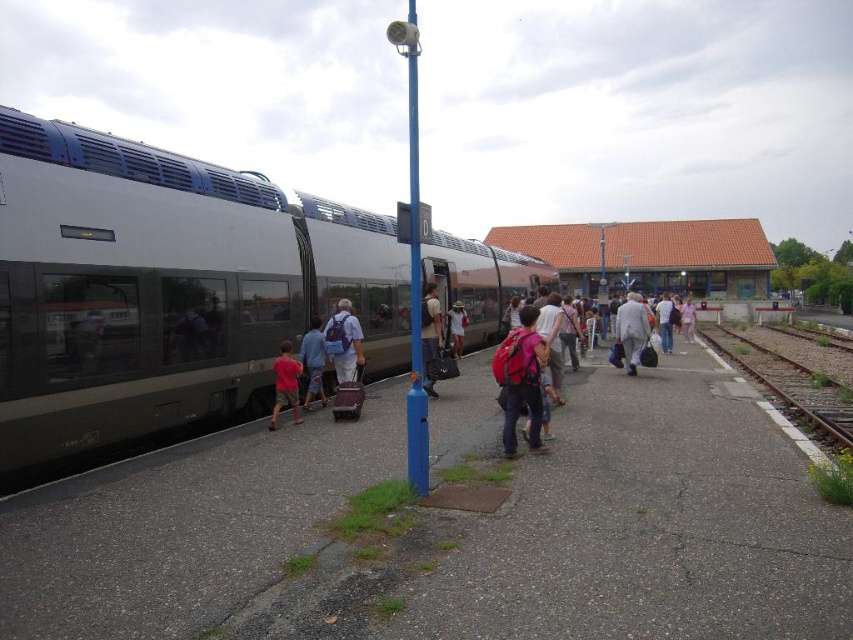
Which is more to the right, matte pink backpack at center or pink backpack at center?

Positioned to the right is matte pink backpack at center.

Can you confirm if matte pink backpack at center is bigger than pink backpack at center?

No, matte pink backpack at center is not bigger than pink backpack at center.

Describe the element at coordinates (521, 380) in the screenshot. I see `matte pink backpack at center` at that location.

Identify the location of matte pink backpack at center. (521, 380).

Who is more forward, (431,326) or (660,305)?

Point (431,326) is in front.

Find the location of a particular element. Image resolution: width=853 pixels, height=640 pixels. denim jacket at center is located at coordinates (430, 337).

Does denim jacket at center have a smaller size compared to pink backpack at center?

No.

Between denim jacket at center and pink backpack at center, which one is positioned higher?

denim jacket at center is above.

This screenshot has height=640, width=853. Describe the element at coordinates (430, 337) in the screenshot. I see `denim jacket at center` at that location.

Image resolution: width=853 pixels, height=640 pixels. Identify the location of denim jacket at center. (430, 337).